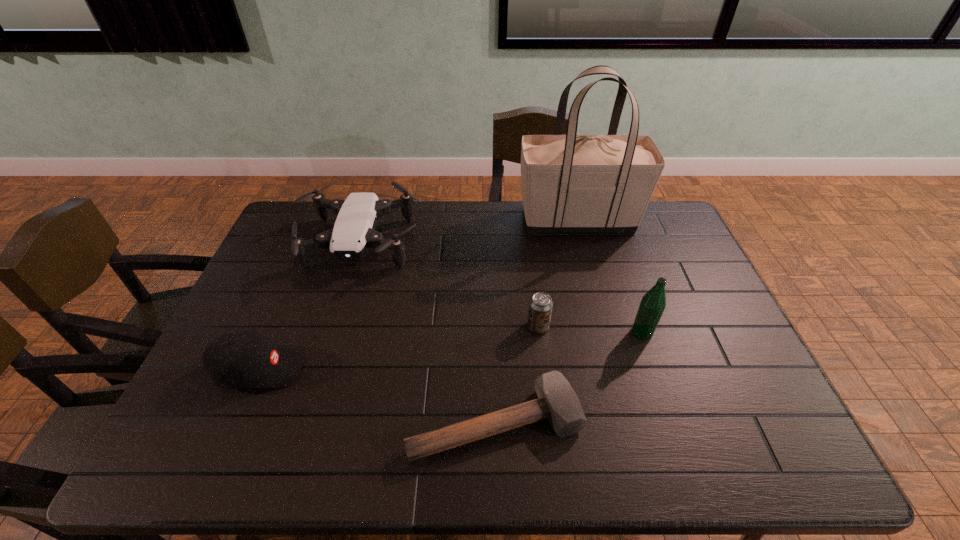
This screenshot has width=960, height=540. In order to click on object positioned at the far left corner in this screenshot , I will do `click(354, 232)`.

Locate an element on the screen. This screenshot has height=540, width=960. object present at the far right corner is located at coordinates (571, 183).

Image resolution: width=960 pixels, height=540 pixels. In the image, there is a desktop. Find the location of `vacant space at the far edge`. vacant space at the far edge is located at coordinates (456, 219).

Identify the location of free space at the near edge of the desktop. The width and height of the screenshot is (960, 540). (625, 435).

Find the location of `free space at the right edge of the desktop`. free space at the right edge of the desktop is located at coordinates (678, 252).

The width and height of the screenshot is (960, 540). I want to click on vacant space at the near left corner of the desktop, so click(193, 450).

Find the location of a particular element. vacant space at the far right corner of the desktop is located at coordinates (651, 204).

Locate an element on the screen. The height and width of the screenshot is (540, 960). vacant space at the near right corner of the desktop is located at coordinates (729, 448).

I want to click on vacant area between the fifth shortest object and the drone, so click(x=501, y=288).

Locate an element on the screen. vacant region between the beer can and the tallest object is located at coordinates (558, 274).